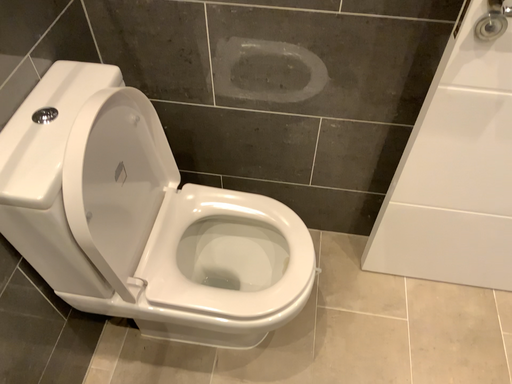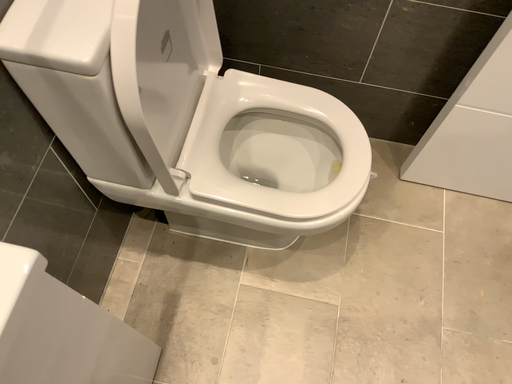
Question: How did the camera likely rotate when shooting the video?

Choices:
 (A) rotated upward
 (B) rotated downward

Answer: (B)